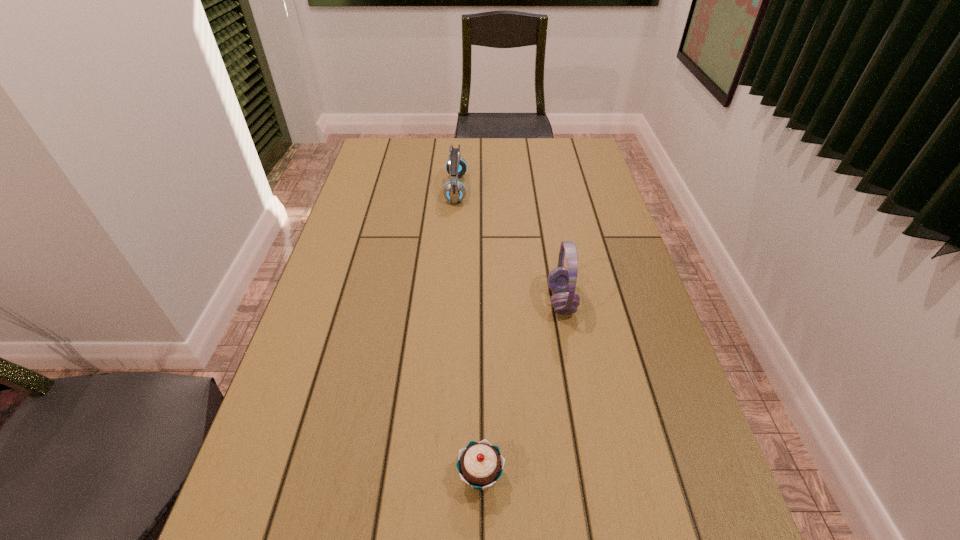
The height and width of the screenshot is (540, 960). What are the coordinates of `the nearer headset` in the screenshot? It's located at (561, 280).

Identify the location of the second nearest object. The height and width of the screenshot is (540, 960). (561, 280).

You are a GUI agent. You are given a task and a screenshot of the screen. Output one action in this format:
    pyautogui.click(x=<x>, y=<y>)
    Task: Click on the shorter headset
    This screenshot has height=540, width=960.
    Given the screenshot: What is the action you would take?
    pyautogui.click(x=454, y=191)

Identify the location of the left headset. Image resolution: width=960 pixels, height=540 pixels. (454, 191).

The image size is (960, 540). I want to click on cupcake, so click(480, 464).

You are a GUI agent. You are given a task and a screenshot of the screen. Output one action in this format:
    pyautogui.click(x=<x>, y=<y>)
    Task: Click on the shortest object
    The width and height of the screenshot is (960, 540).
    Given the screenshot: What is the action you would take?
    pyautogui.click(x=480, y=464)

You are a GUI agent. You are given a task and a screenshot of the screen. Output one action in this format:
    pyautogui.click(x=<x>, y=<y>)
    Task: Click on the vacant space situated 0.110m on the headband and ear cups of the taller headset
    The height and width of the screenshot is (540, 960).
    Given the screenshot: What is the action you would take?
    pyautogui.click(x=503, y=301)

Locate an element on the screen. free spot located on the headband and ear cups of the taller headset is located at coordinates (508, 301).

Find the location of a particular element. The image size is (960, 540). vacant region located 0.320m on the headband and ear cups of the taller headset is located at coordinates (420, 301).

Where is `free space located on the ear cups of the left headset`? Image resolution: width=960 pixels, height=540 pixels. free space located on the ear cups of the left headset is located at coordinates (482, 189).